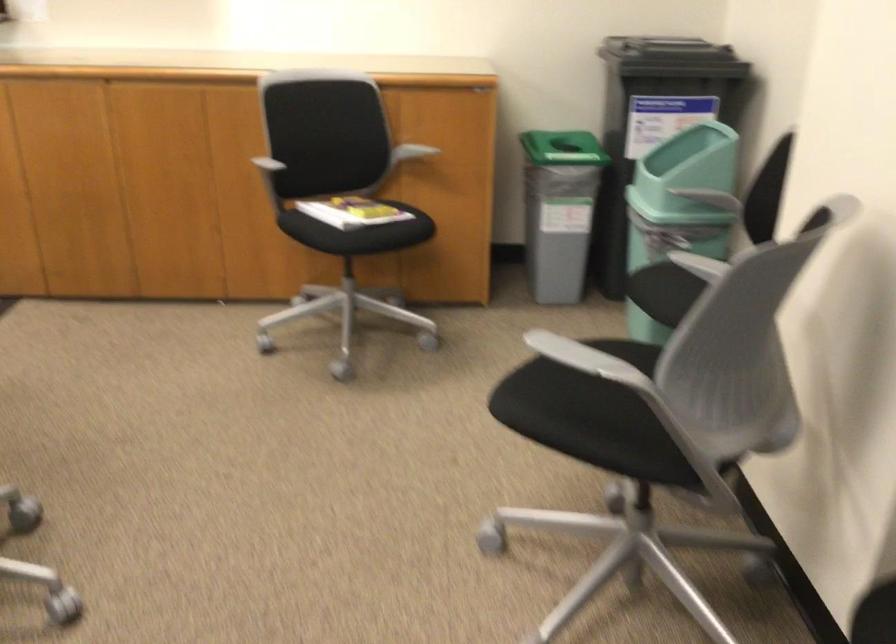
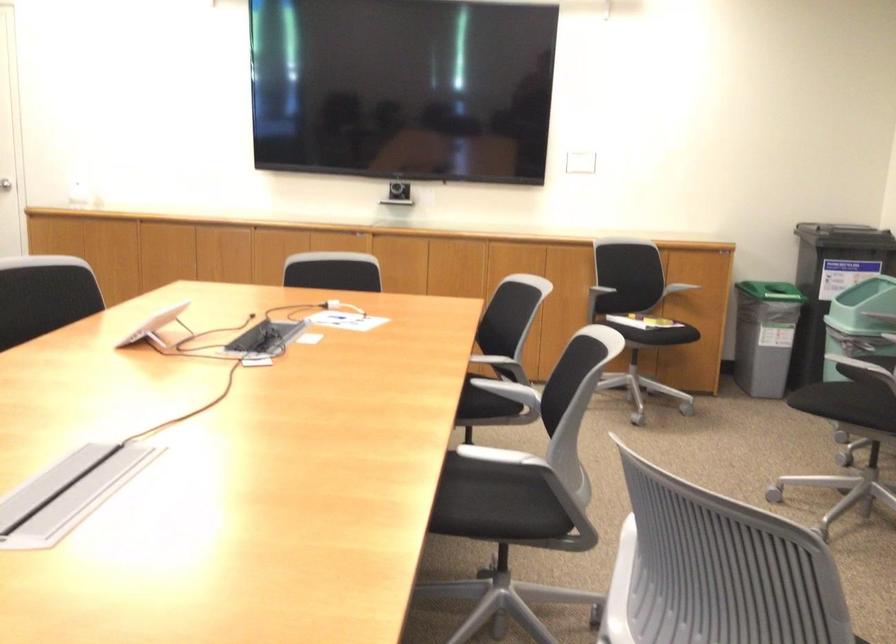
In the second image, find the point that corresponds to point 341,228 in the first image.

(636, 313)